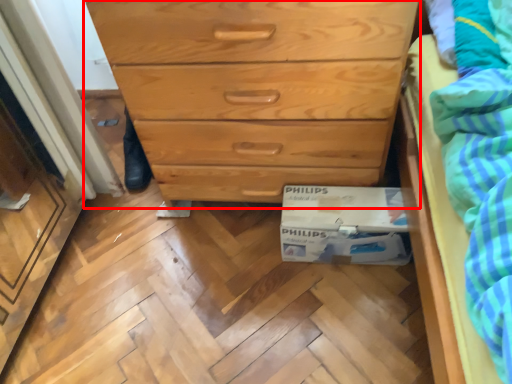
Question: From the image's perspective, considering the relative positions of chest of drawers (annotated by the red box) and cardboard box in the image provided, where is chest of drawers (annotated by the red box) located with respect to the staircase?

Choices:
 (A) above
 (B) below

Answer: (A)